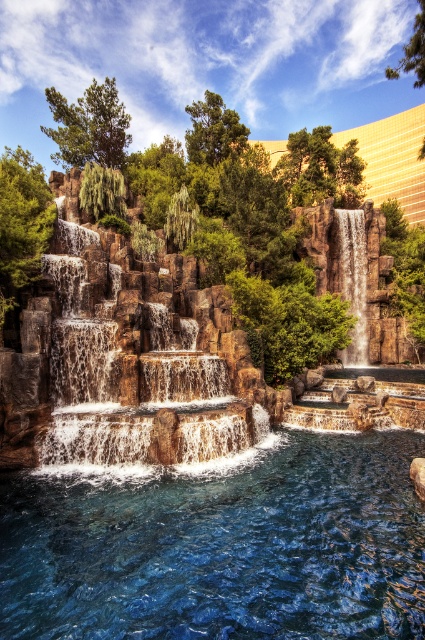
You are a landscape architect designing a new garden. You need to place a decorative statue that requires a base of 1.2 meters in width. The statue will be placed where the translucent blue water at center and brown textured rock waterfall at center are located. Which location would allow the statue to fit properly?

The translucent blue water at center is smaller than the brown textured rock waterfall at center. Since the statue requires a base of 1.2 meters, the brown textured rock waterfall at center is larger and would provide enough space for the statue to fit properly.